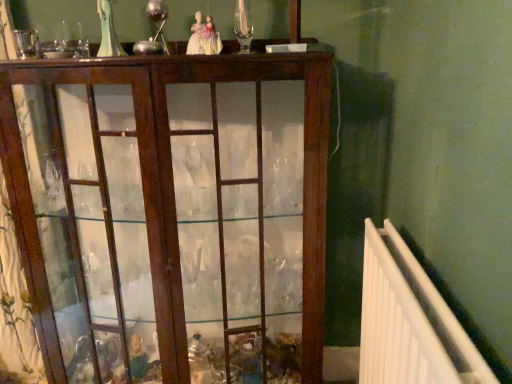
Question: From a real-world perspective, is white plastic radiator at right under mahogany glass cabinet at center?

Choices:
 (A) no
 (B) yes

Answer: (B)

Question: Can you confirm if white plastic radiator at right is taller than mahogany glass cabinet at center?

Choices:
 (A) yes
 (B) no

Answer: (B)

Question: Can you confirm if white plastic radiator at right is smaller than mahogany glass cabinet at center?

Choices:
 (A) no
 (B) yes

Answer: (B)

Question: Does white plastic radiator at right come in front of mahogany glass cabinet at center?

Choices:
 (A) yes
 (B) no

Answer: (A)

Question: Is there a large distance between white plastic radiator at right and mahogany glass cabinet at center?

Choices:
 (A) yes
 (B) no

Answer: (B)

Question: Does white plastic radiator at right have a greater width compared to mahogany glass cabinet at center?

Choices:
 (A) no
 (B) yes

Answer: (A)

Question: Is mahogany glass cabinet at center facing towards white plastic radiator at right?

Choices:
 (A) yes
 (B) no

Answer: (B)

Question: Can you confirm if mahogany glass cabinet at center is shorter than white plastic radiator at right?

Choices:
 (A) no
 (B) yes

Answer: (A)

Question: From a real-world perspective, does mahogany glass cabinet at center sit lower than white plastic radiator at right?

Choices:
 (A) yes
 (B) no

Answer: (B)

Question: Does mahogany glass cabinet at center have a smaller size compared to white plastic radiator at right?

Choices:
 (A) yes
 (B) no

Answer: (B)

Question: Would you say mahogany glass cabinet at center contains white plastic radiator at right?

Choices:
 (A) yes
 (B) no

Answer: (B)

Question: Considering the relative positions of mahogany glass cabinet at center and white plastic radiator at right in the image provided, is mahogany glass cabinet at center behind white plastic radiator at right?

Choices:
 (A) no
 (B) yes

Answer: (B)

Question: From the image's perspective, is mahogany glass cabinet at center located above or below white plastic radiator at right?

Choices:
 (A) above
 (B) below

Answer: (A)